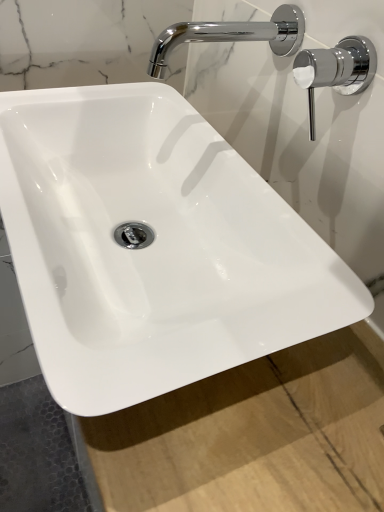
Question: From the image's perspective, would you say chrome/metallic faucet at upper right is positioned over chrome/metallic faucet at upper right?

Choices:
 (A) yes
 (B) no

Answer: (B)

Question: Considering the relative sizes of chrome/metallic faucet at upper right and chrome/metallic faucet at upper right in the image provided, is chrome/metallic faucet at upper right taller than chrome/metallic faucet at upper right?

Choices:
 (A) yes
 (B) no

Answer: (B)

Question: Is chrome/metallic faucet at upper right positioned with its back to chrome/metallic faucet at upper right?

Choices:
 (A) no
 (B) yes

Answer: (A)

Question: Does chrome/metallic faucet at upper right turn towards chrome/metallic faucet at upper right?

Choices:
 (A) yes
 (B) no

Answer: (B)

Question: Does chrome/metallic faucet at upper right have a lesser width compared to chrome/metallic faucet at upper right?

Choices:
 (A) no
 (B) yes

Answer: (B)

Question: From a real-world perspective, is chrome/metallic faucet at upper right over chrome/metallic faucet at upper right?

Choices:
 (A) yes
 (B) no

Answer: (B)

Question: Does chrome/metallic faucet at upper right appear on the left side of chrome/metallic faucet at upper right?

Choices:
 (A) yes
 (B) no

Answer: (A)

Question: Is the depth of chrome/metallic faucet at upper right greater than that of chrome/metallic faucet at upper right?

Choices:
 (A) no
 (B) yes

Answer: (B)

Question: Are chrome/metallic faucet at upper right and chrome/metallic faucet at upper right located far from each other?

Choices:
 (A) no
 (B) yes

Answer: (A)

Question: Considering the relative positions of chrome/metallic faucet at upper right and chrome/metallic faucet at upper right in the image provided, is chrome/metallic faucet at upper right in front of chrome/metallic faucet at upper right?

Choices:
 (A) no
 (B) yes

Answer: (A)

Question: Would you say chrome/metallic faucet at upper right is outside chrome/metallic faucet at upper right?

Choices:
 (A) no
 (B) yes

Answer: (B)

Question: From the image's perspective, is chrome/metallic faucet at upper right on chrome/metallic faucet at upper right?

Choices:
 (A) yes
 (B) no

Answer: (A)

Question: In terms of width, does chrome/metallic faucet at upper right look wider or thinner when compared to chrome/metallic faucet at upper right?

Choices:
 (A) thin
 (B) wide

Answer: (A)